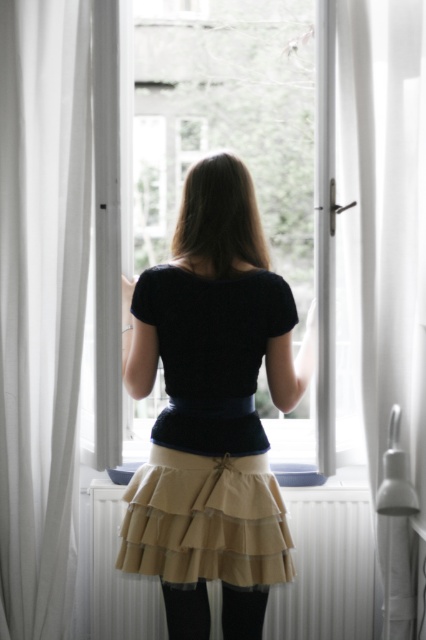
From the picture: You are a photographer wanting to capture the view outside through the window. Which object, the white sheer curtain at left or the transparent glass window at center, would allow you to see the outside more clearly?

The transparent glass window at center allows clearer visibility since it is thicker than the white sheer curtain at left, which is thinner and may obstruct the view slightly.

You are standing in the room and want to adjust the white sheer curtain at left so it covers the black cotton shirt at center. Is the curtain positioned to the left or right of the shirt?

The white sheer curtain at left is to the left of the black cotton shirt at center, so it is positioned to the left of the shirt.